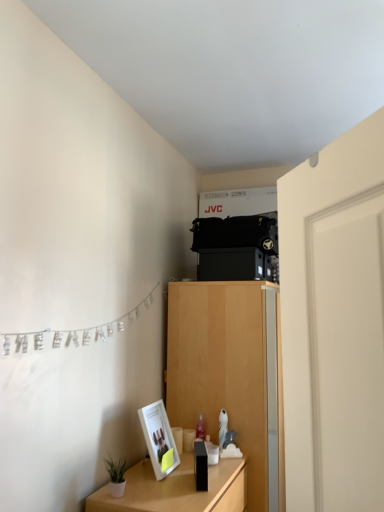
Where is `free location in front of matte white picture frame at lower left`? free location in front of matte white picture frame at lower left is located at coordinates (155, 485).